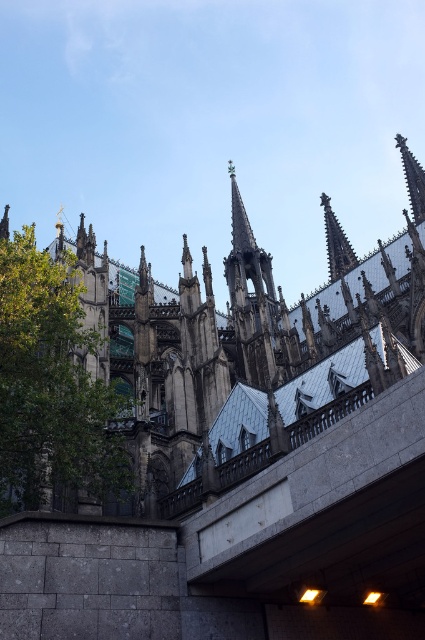
Question: Which of the following is the farthest from the observer?

Choices:
 (A) green leafy tree at left
 (B) dark gray stone spire at center

Answer: (B)

Question: Can you confirm if green leafy tree at left is smaller than dark gray stone spire at center?

Choices:
 (A) yes
 (B) no

Answer: (A)

Question: Is the position of green leafy tree at left more distant than that of dark gray stone spire at center?

Choices:
 (A) yes
 (B) no

Answer: (B)

Question: Does green leafy tree at left have a greater width compared to dark gray stone spire at center?

Choices:
 (A) yes
 (B) no

Answer: (A)